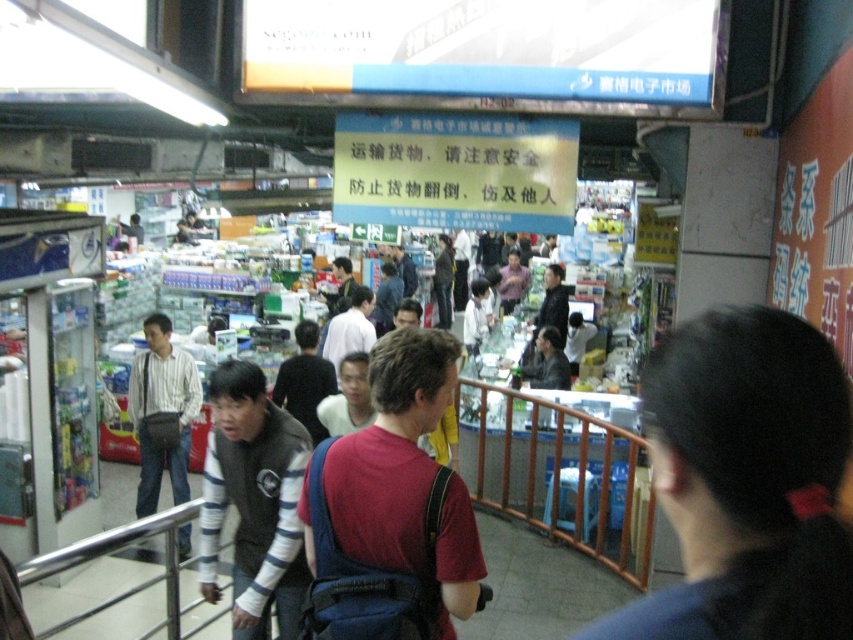
Question: Which point is closer to the camera?

Choices:
 (A) (782, 401)
 (B) (339, 604)
 (C) (471, 458)
 (D) (299, 552)

Answer: (A)

Question: Which object appears closest to the camera in this image?

Choices:
 (A) dark brown hair at center
 (B) striped cotton shirt at left

Answer: (A)

Question: Does dark brown hair at center appear on the right side of red fabric shirt at center?

Choices:
 (A) no
 (B) yes

Answer: (B)

Question: Can you confirm if red fabric shirt at center is positioned to the right of striped cotton shirt at left?

Choices:
 (A) no
 (B) yes

Answer: (B)

Question: Which object is closer to the camera taking this photo?

Choices:
 (A) striped cotton shirt at left
 (B) striped sweater at center
 (C) brown wooden rail at center

Answer: (B)

Question: Does red fabric shirt at center appear on the left side of striped cotton shirt at left?

Choices:
 (A) yes
 (B) no

Answer: (B)